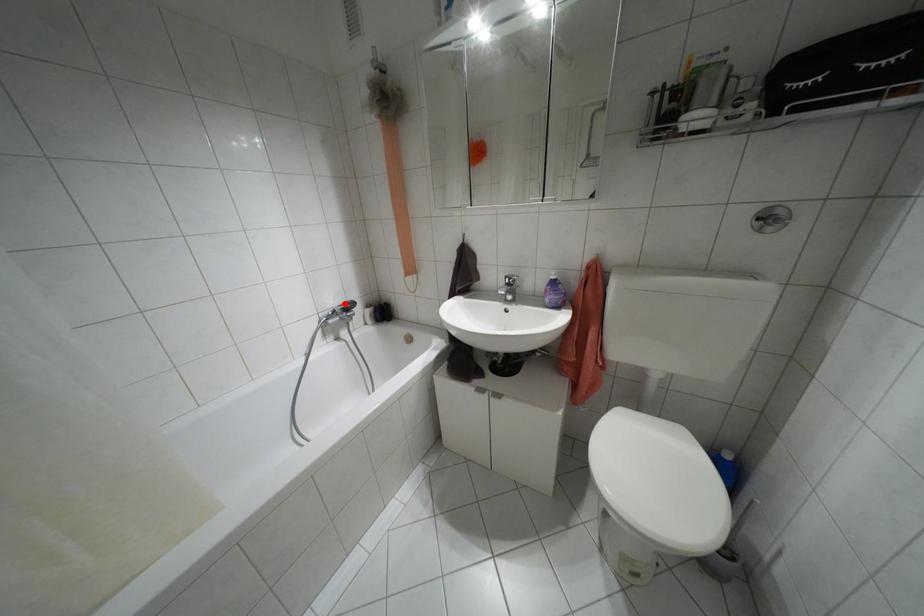
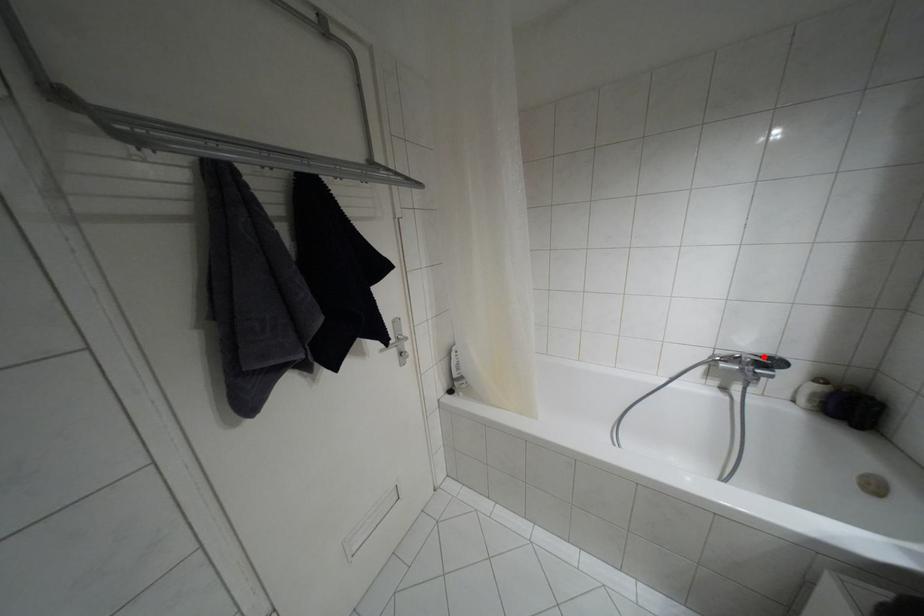
I am providing you with two images of the same scene from different viewpoints. A red point is marked on the first image and another point is marked on the second image. Does the point marked in image1 correspond to the same location as the one in image2?

Yes